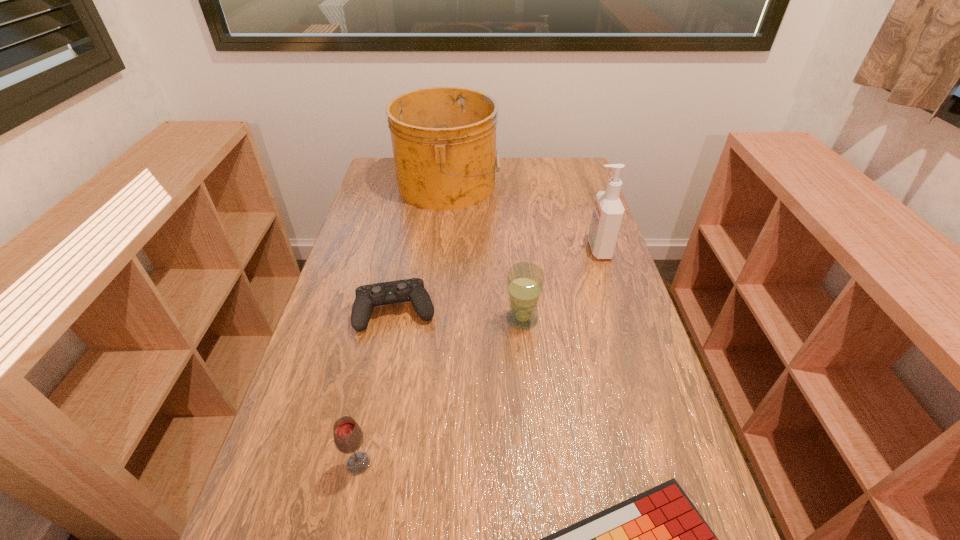
You are a GUI agent. You are given a task and a screenshot of the screen. Output one action in this format:
    pyautogui.click(x=<x>, y=<y>)
    Task: Click on the vacant region located on the front of the farther glass drink container
    The width and height of the screenshot is (960, 540).
    Given the screenshot: What is the action you would take?
    pos(533,430)

Identify the location of free point located on the front of the fifth farthest object. (345, 532).

The width and height of the screenshot is (960, 540). Identify the location of free location located on the right of the control. (458, 311).

You are a GUI agent. You are given a task and a screenshot of the screen. Output one action in this format:
    pyautogui.click(x=<x>, y=<y>)
    Task: Click on the object that is positioned at the far edge
    The height and width of the screenshot is (540, 960).
    Given the screenshot: What is the action you would take?
    pyautogui.click(x=444, y=138)

At what (x,y) coordinates should I click in order to perform the action: click on bucket that is at the left edge. Please return your answer as a coordinate pair (x, y). This screenshot has height=540, width=960. Looking at the image, I should click on (444, 138).

The width and height of the screenshot is (960, 540). I want to click on glass drink container located in the left edge section of the desktop, so click(x=348, y=437).

Where is `control at the left edge`? control at the left edge is located at coordinates (367, 296).

You are a GUI agent. You are given a task and a screenshot of the screen. Output one action in this format:
    pyautogui.click(x=<x>, y=<y>)
    Task: Click on the object at the right edge
    This screenshot has width=960, height=540.
    Given the screenshot: What is the action you would take?
    pyautogui.click(x=608, y=212)

Where is `object that is positioned at the far left corner`? object that is positioned at the far left corner is located at coordinates (444, 138).

Where is `free region at the far edge of the desktop`? Image resolution: width=960 pixels, height=540 pixels. free region at the far edge of the desktop is located at coordinates (519, 183).